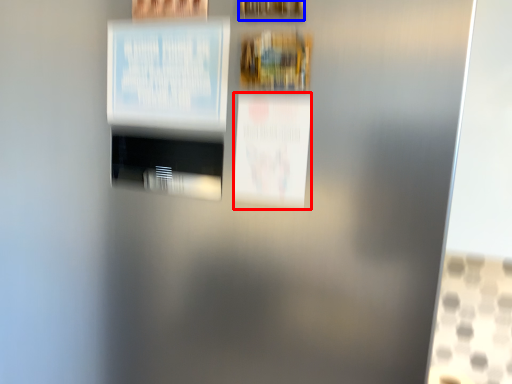
Question: Which of the following is the farthest to the observer, poster (highlighted by a red box) or picture frame (highlighted by a blue box)?

Choices:
 (A) poster
 (B) picture frame

Answer: (A)